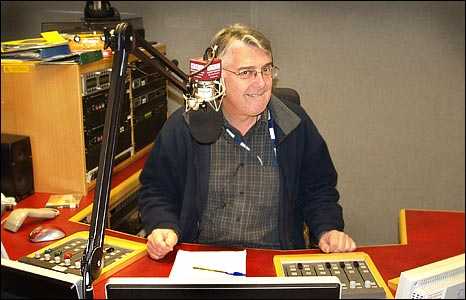
Where is `binders`? binders is located at coordinates (93, 58), (54, 50).